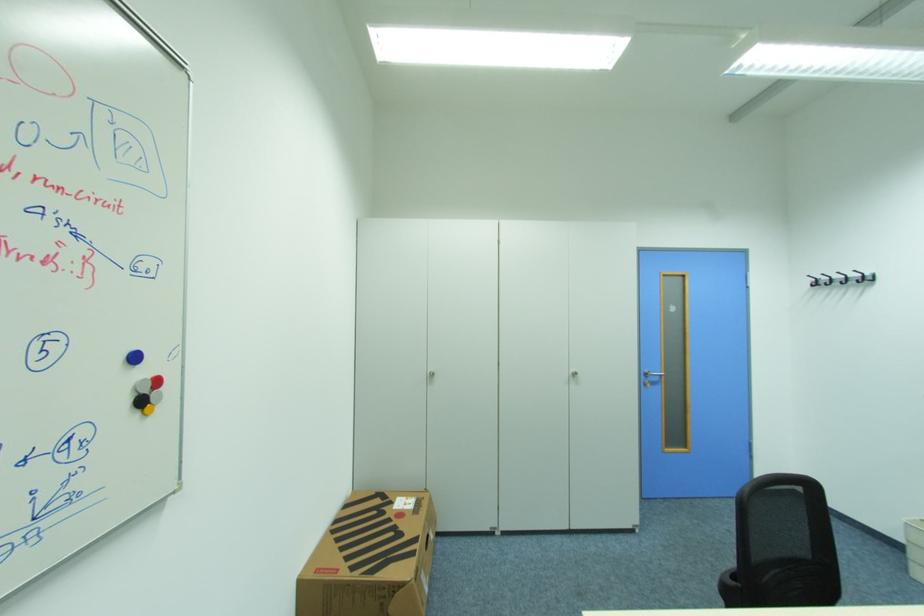
The location [371,557] corresponds to which object?

It corresponds to the brown cardboard box in the image.